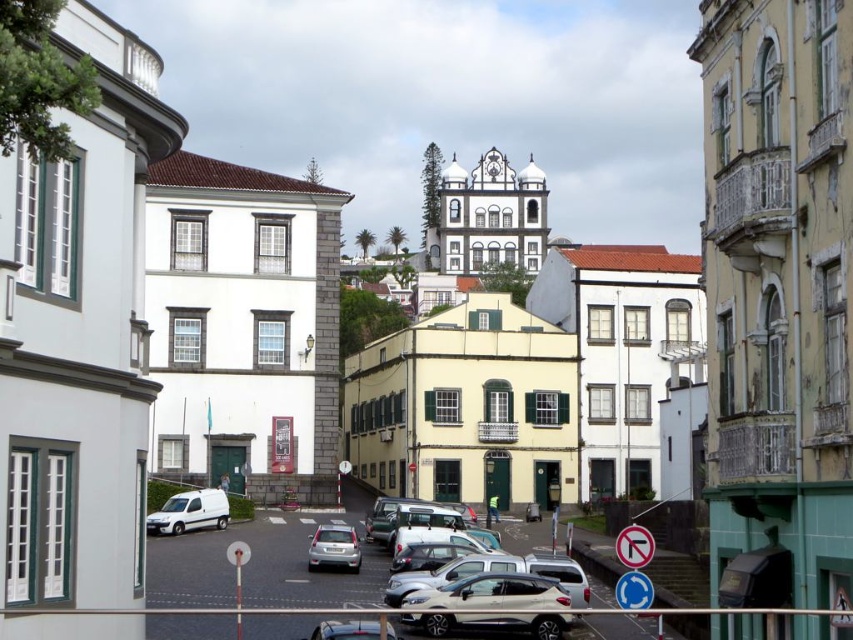
You are a delivery driver who needs to park your car in a parking spot that is exactly the width of the satin silver car at center. You are driving a silver metallic car at center. Will your car fit into the parking spot?

The silver metallic car at center is wider than the satin silver car at center, so your car will not fit into the parking spot designed for the satin silver car at center.

You are a delivery driver who needs to park your car in this urban area. You see a silver metallic car at center and a satin silver car at center. Which car is parked above the other?

The silver metallic car at center is positioned under the satin silver car at center, so the satin silver car at center is parked above the silver metallic car at center.

You are driving a car and need to park in the area shown. The parking spot you want is at coordinates point 0.947, 0.579. Is the satin silver suv at center currently occupying that spot?

The satin silver suv at center is located at point (492, 605), so yes, it is occupying the parking spot you want.